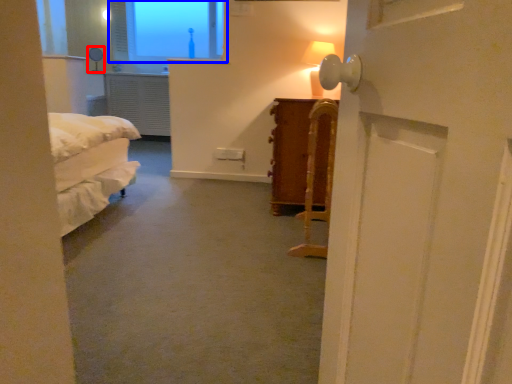
Question: Which point is further to the camera, table lamp (highlighted by a red box) or window (highlighted by a blue box)?

Choices:
 (A) table lamp
 (B) window

Answer: (B)